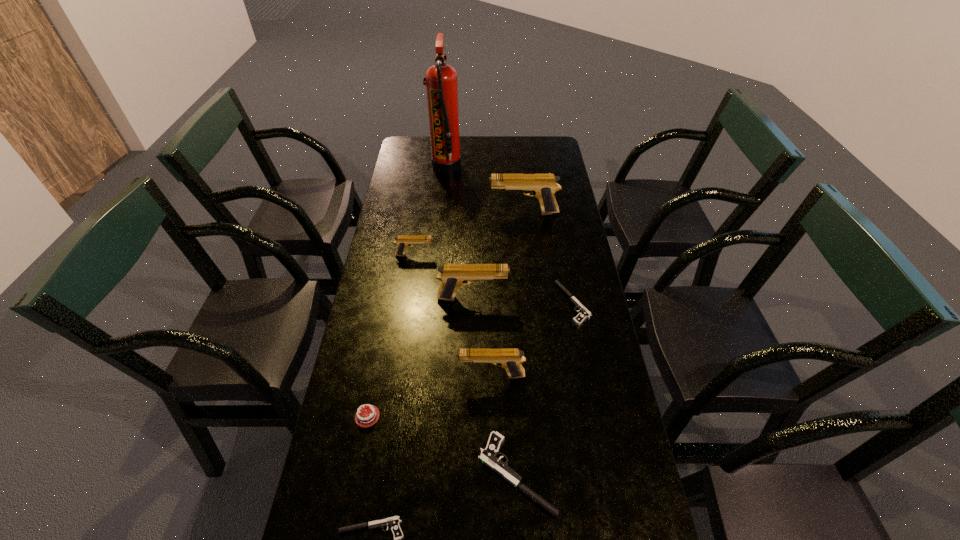
Find the location of `free region located at the barrel of the third farthest tan pistol`. free region located at the barrel of the third farthest tan pistol is located at coordinates (551, 298).

Identify the location of free space located at the barrel of the nearest tan pistol. The width and height of the screenshot is (960, 540). (387, 375).

In order to click on free region located 0.100m at the barrel of the nearest tan pistol in this screenshot , I will do `click(423, 375)`.

At what (x,y) coordinates should I click in order to perform the action: click on free space located at the barrel of the nearest tan pistol. Please return your answer as a coordinate pair (x, y). Looking at the image, I should click on (405, 375).

Where is `free spot located at the barrel of the fourth shortest pistol`? The height and width of the screenshot is (540, 960). free spot located at the barrel of the fourth shortest pistol is located at coordinates (476, 255).

Identify the location of vacant area situated on the back of the chocolate cake. (393, 284).

Where is `vacant space located 0.310m on the front-facing side of the biggest black pistol`? vacant space located 0.310m on the front-facing side of the biggest black pistol is located at coordinates (346, 474).

Identify the location of vacant space located on the front-facing side of the biggest black pistol. (419, 474).

I want to click on free spot located on the front-facing side of the biggest black pistol, so click(337, 474).

Locate an element on the screen. vacant point located on the front-facing side of the farthest black pistol is located at coordinates (468, 303).